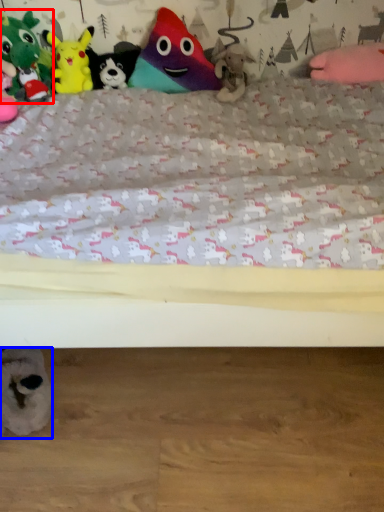
Question: Among these objects, which one is nearest to the camera, toy (highlighted by a red box) or toy (highlighted by a blue box)?

Choices:
 (A) toy
 (B) toy

Answer: (B)